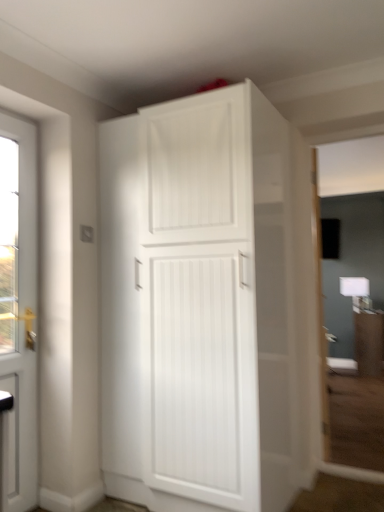
Question: Should I look upward or downward to see white glossy door at left?

Choices:
 (A) up
 (B) down

Answer: (B)

Question: Could you tell me if white matte cabinet at upper center is turned towards white glossy door at left?

Choices:
 (A) no
 (B) yes

Answer: (A)

Question: Does white matte cabinet at upper center have a greater height compared to white glossy door at left?

Choices:
 (A) no
 (B) yes

Answer: (B)

Question: From a real-world perspective, is white matte cabinet at upper center on top of white glossy door at left?

Choices:
 (A) no
 (B) yes

Answer: (B)

Question: Is white matte cabinet at upper center positioned beyond the bounds of white glossy door at left?

Choices:
 (A) no
 (B) yes

Answer: (B)

Question: Is white glossy door at left completely or partially inside white matte cabinet at upper center?

Choices:
 (A) yes
 (B) no

Answer: (B)

Question: From the image's perspective, is white matte cabinet at upper center located beneath white glossy door at left?

Choices:
 (A) yes
 (B) no

Answer: (B)

Question: From the image's perspective, would you say white glossy door at left is shown under white matte cabinet at upper center?

Choices:
 (A) no
 (B) yes

Answer: (B)

Question: Considering the relative positions of white glossy door at left and white matte cabinet at upper center in the image provided, is white glossy door at left to the left of white matte cabinet at upper center from the viewer's perspective?

Choices:
 (A) yes
 (B) no

Answer: (A)

Question: Is white glossy door at left not near white matte cabinet at upper center?

Choices:
 (A) no
 (B) yes

Answer: (A)

Question: Is white matte cabinet at upper center inside white glossy door at left?

Choices:
 (A) no
 (B) yes

Answer: (A)

Question: Considering the relative sizes of white glossy door at left and white matte cabinet at upper center in the image provided, is white glossy door at left smaller than white matte cabinet at upper center?

Choices:
 (A) yes
 (B) no

Answer: (A)

Question: Is white glossy door at left placed right next to white matte cabinet at upper center?

Choices:
 (A) yes
 (B) no

Answer: (B)

Question: Is matte white cabinet at center taller than white matte cabinet at upper center?

Choices:
 (A) no
 (B) yes

Answer: (A)